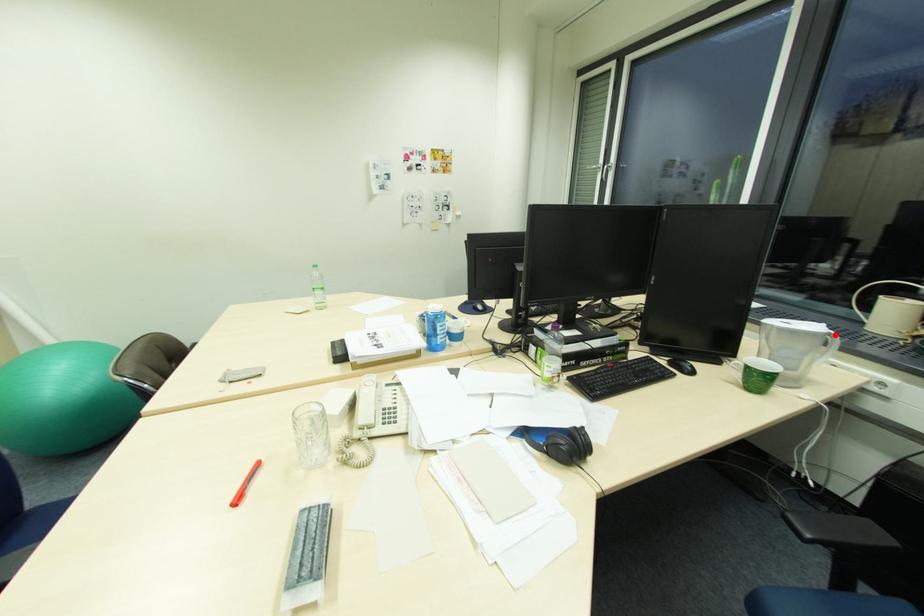
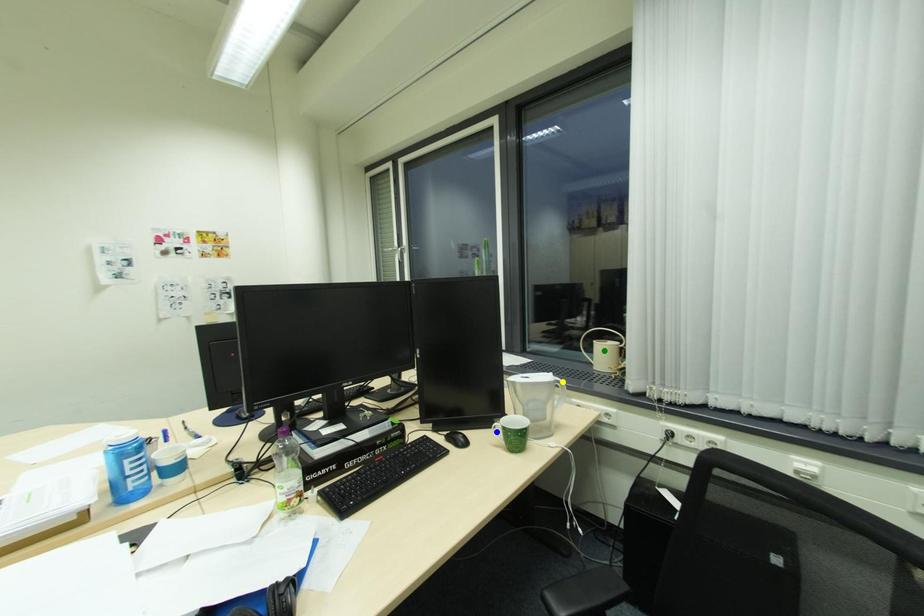
Question: I am providing you with two images of the same scene from different viewpoints. A red point is marked on the first image. You are given multiple points on the second image. In image 2, which mark is for the same physical point as the one in image 1?

Choices:
 (A) blue point
 (B) yellow point
 (C) green point

Answer: (B)